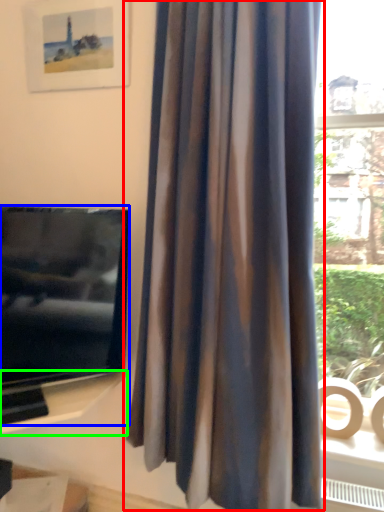
Question: Estimate the real-world distances between objects in this image. Which object is farther from curtain (highlighted by a red box), television (highlighted by a blue box) or shelf (highlighted by a green box)?

Choices:
 (A) television
 (B) shelf

Answer: (B)